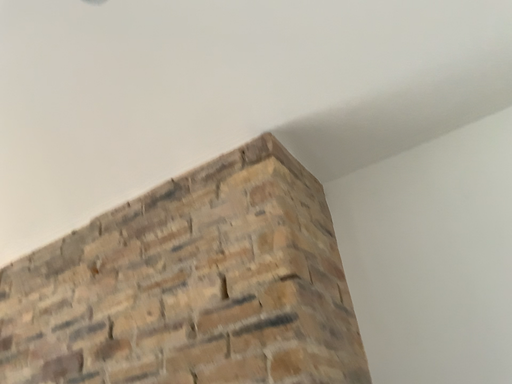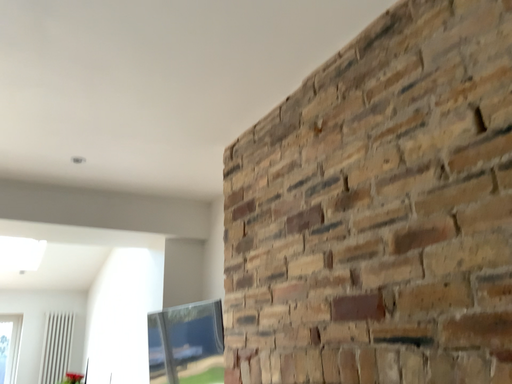
Question: Which way did the camera rotate in the video?

Choices:
 (A) rotated right
 (B) rotated left

Answer: (B)